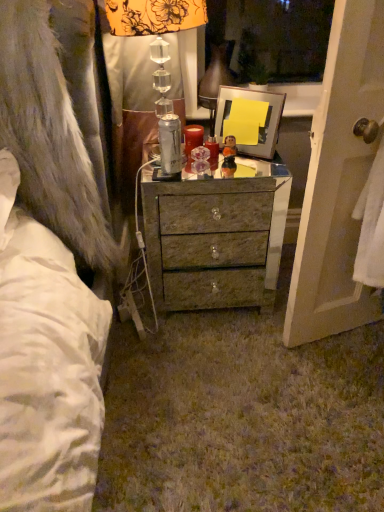
Where is `free spot below shiny metallic drawer at center (from a real-world perspective)`? free spot below shiny metallic drawer at center (from a real-world perspective) is located at coordinates (201, 307).